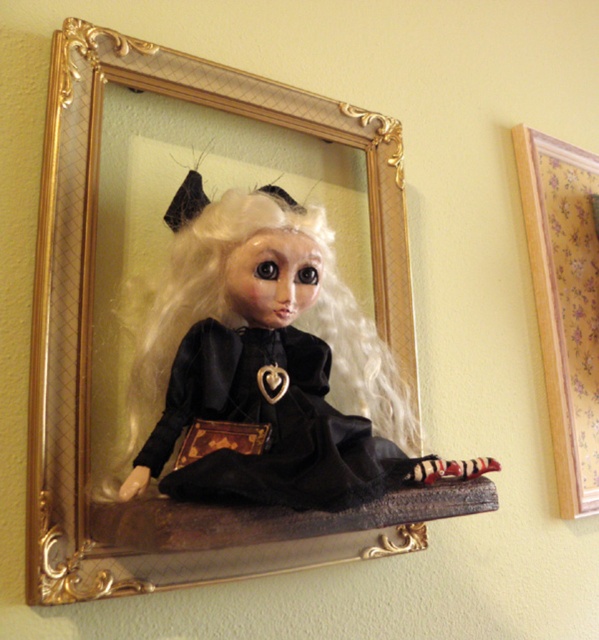
Who is more forward, (x=101, y=92) or (x=580, y=410)?

Positioned in front is point (x=101, y=92).

Is point (74, 179) farther from camera compared to point (547, 259)?

That is False.

You are a GUI agent. You are given a task and a screenshot of the screen. Output one action in this format:
    pyautogui.click(x=<x>, y=<y>)
    Task: Click on the goldwoodenpicture frame at center
    This screenshot has width=599, height=640.
    Given the screenshot: What is the action you would take?
    pyautogui.click(x=92, y=346)

Is point (195, 208) positioned behind point (522, 202)?

No, (195, 208) is closer to viewer.

Who is taller, white silky hair at center or wooden at upper right?

Standing taller between the two is wooden at upper right.

At what (x,y) coordinates should I click in order to perform the action: click on white silky hair at center. Please return your answer as a coordinate pair (x, y). The width and height of the screenshot is (599, 640). Looking at the image, I should click on (241, 314).

Who is more forward, [138,522] or [261,189]?

Point [138,522]

Does point (52, 269) lie behind point (359, 353)?

No, (52, 269) is closer to viewer.

Identify the location of goldwoodenpicture frame at center. The image size is (599, 640). (92, 346).